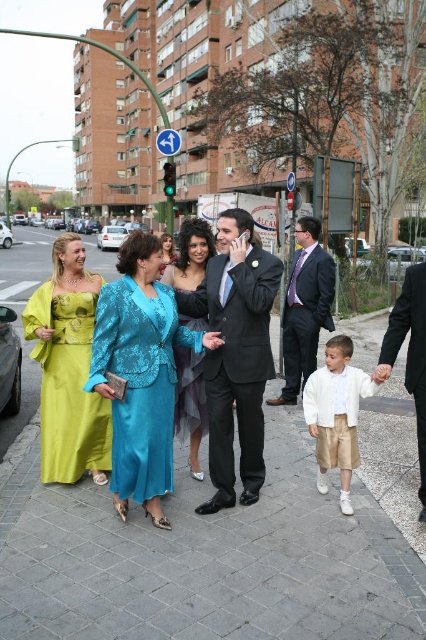
You are a delivery person who needs to place a small package on the satin fabric pavement at center and the black satin suit at right. Which surface can accommodate the package without it hanging off the edges?

The satin fabric pavement at center has a larger size compared to the black satin suit at right, so the package can be placed on the satin fabric pavement at center without it hanging off the edges.

You are a photographer standing on the sidewalk and want to take a photo of both the matte black suit at center and the shiny teal dress at center. Which one should you focus on first if you want to capture them both in the same frame without moving the camera?

You should focus on the shiny teal dress at center first because the matte black suit at center is to the right of it, allowing both to be in the same frame by centering the dress and including the suit to its right.